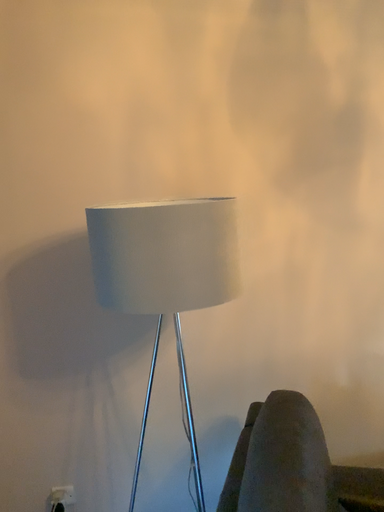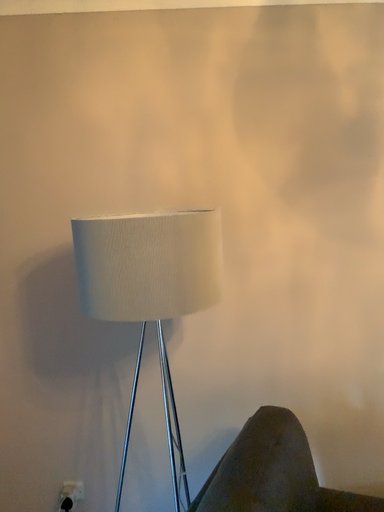
Question: Which way did the camera rotate in the video?

Choices:
 (A) rotated right
 (B) rotated left

Answer: (B)